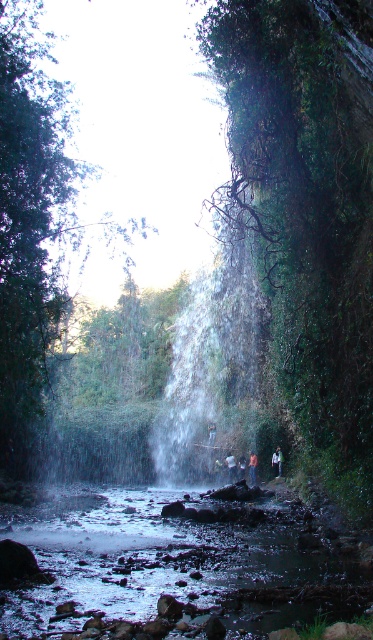
Question: Can you confirm if translucent wet rocks at center is smaller than white mist at center?

Choices:
 (A) yes
 (B) no

Answer: (A)

Question: Which object appears farthest from the camera in this image?

Choices:
 (A) white mist at center
 (B) dark blue fabric person at center
 (C) translucent wet rocks at center

Answer: (B)

Question: Among these objects, which one is farthest from the camera?

Choices:
 (A) white mist at center
 (B) dark blue fabric person at center
 (C) blue denim jeans at center
 (D) dark blue jeans at center

Answer: (C)

Question: Does white mist at center appear under dark blue jeans at center?

Choices:
 (A) no
 (B) yes

Answer: (A)

Question: Estimate the real-world distances between objects in this image. Which object is farther from the blue denim jeans at center?

Choices:
 (A) white mist at center
 (B) dark blue fabric person at center
 (C) light blue denim jacket at center
 (D) translucent wet rocks at center

Answer: (D)

Question: Is dark blue jeans at center positioned behind blue denim jeans at center?

Choices:
 (A) yes
 (B) no

Answer: (B)